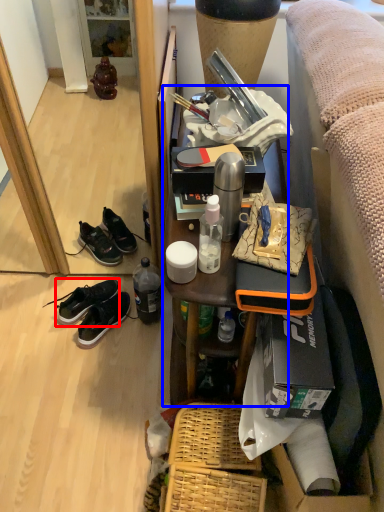
Question: Which point is further to the camera, shoe (highlighted by a red box) or furniture (highlighted by a blue box)?

Choices:
 (A) shoe
 (B) furniture

Answer: (A)